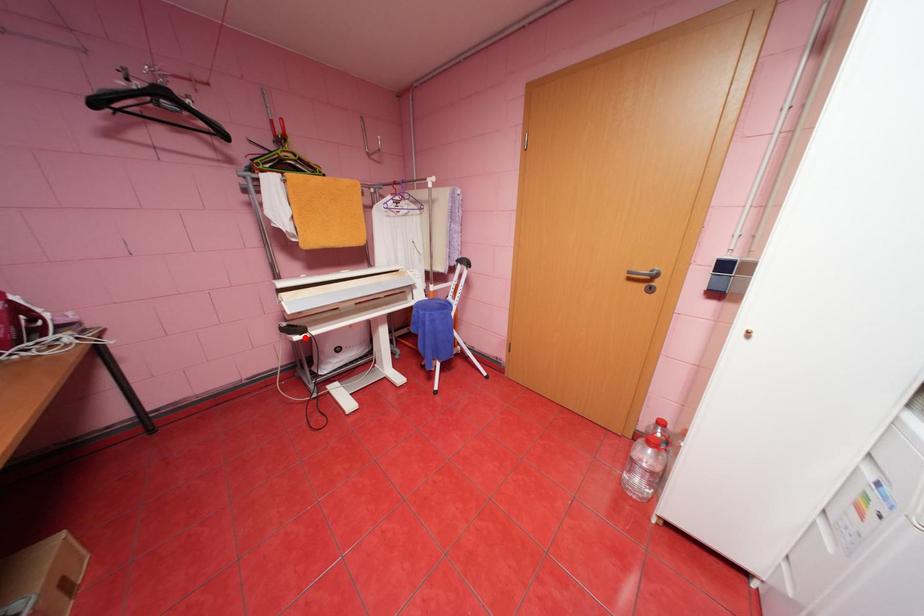
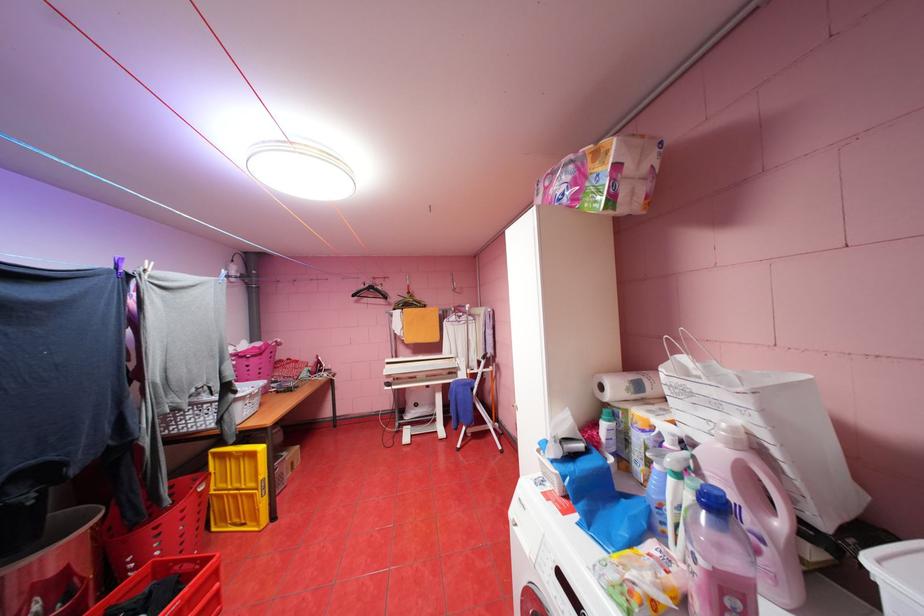
Question: I am providing you with two images of the same scene from different viewpoints. In image1, a red point is highlighted. Considering the same 3D point in image2, which of the following is correct?

Choices:
 (A) It is closer
 (B) It is farther

Answer: (B)